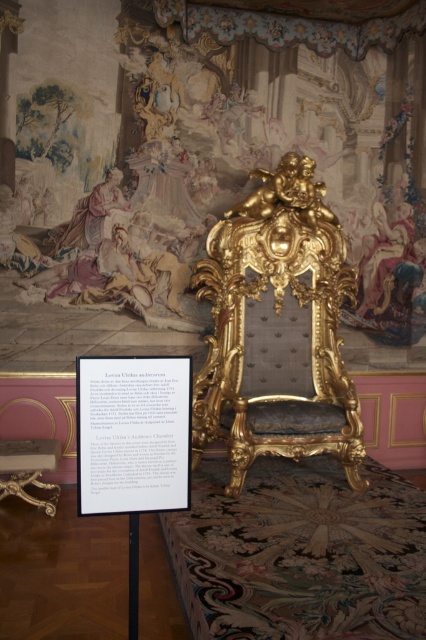
Is gold upholstered armchair at center smaller than gold polished wood table at lower left?

No.

Does gold upholstered armchair at center come behind gold polished wood table at lower left?

Yes.

Is point (219, 380) in front of point (54, 484)?

No, it is not.

The height and width of the screenshot is (640, 426). In order to click on gold upholstered armchair at center in this screenshot , I will do `click(276, 346)`.

Which is more to the left, white paper at center or gold polished wood table at lower left?

From the viewer's perspective, gold polished wood table at lower left appears more on the left side.

Between point (178, 380) and point (20, 481), which one is positioned in front?

Point (178, 380) is more forward.

Where is `white paper at center`? Image resolution: width=426 pixels, height=640 pixels. white paper at center is located at coordinates (132, 433).

Does gold upholstered armchair at center appear on the right side of white paper at center?

Yes, gold upholstered armchair at center is to the right of white paper at center.

Based on the photo, who is higher up, gold upholstered armchair at center or white paper at center?

gold upholstered armchair at center is above.

Does point (268, 442) lie behind point (146, 490)?

Yes, it is.

Locate an element on the screen. Image resolution: width=426 pixels, height=640 pixels. gold upholstered armchair at center is located at coordinates (276, 346).